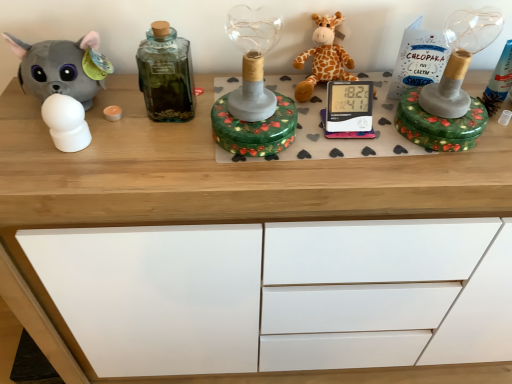
Identify the location of free space in front of orange plush giraffe at center, acting as the second toy starting from the left. The image size is (512, 384). (351, 143).